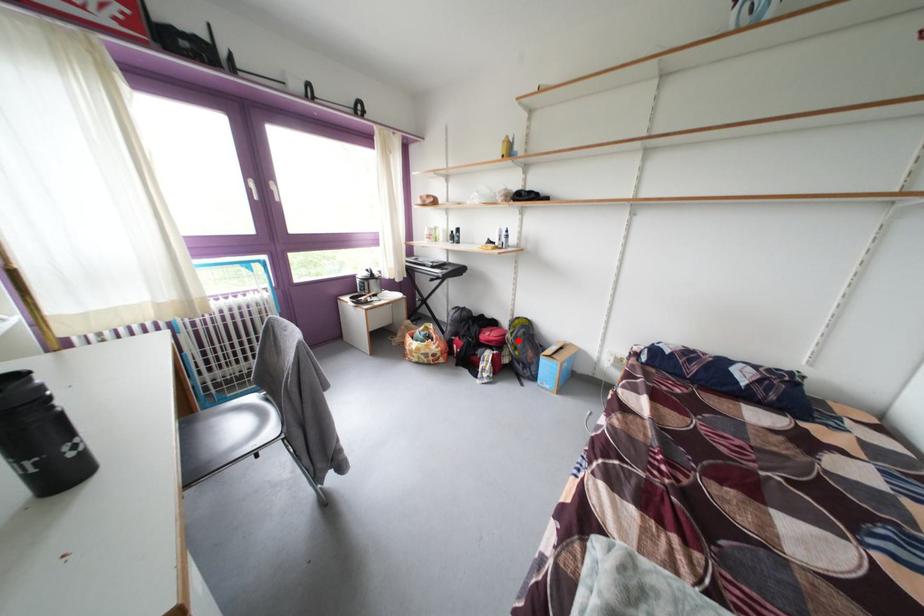
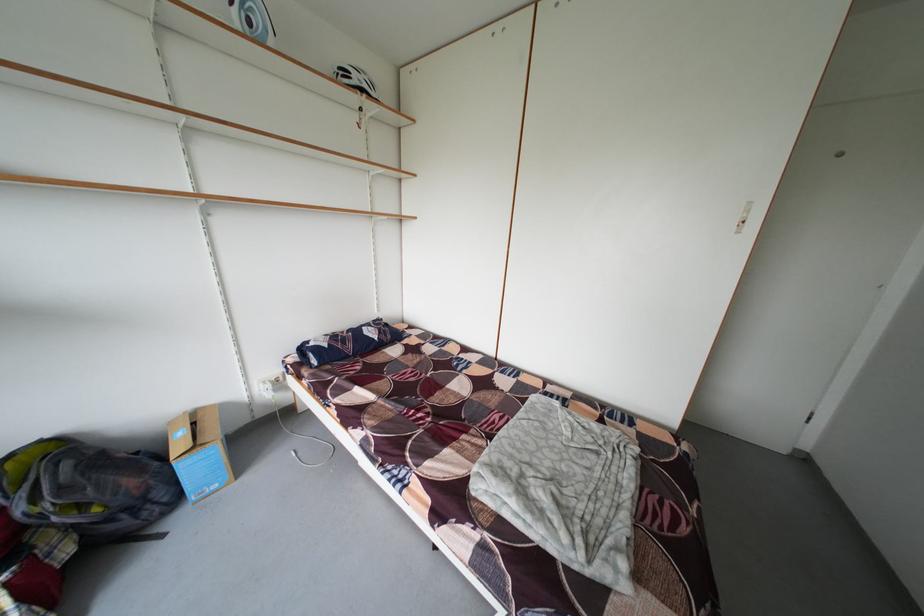
Locate, in the second image, the point that corresponds to the highlighted location in the first image.

(31, 515)